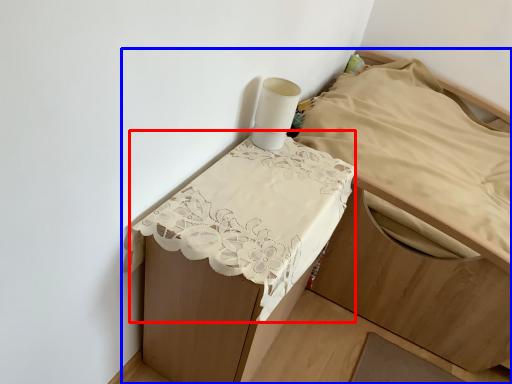
Question: Which object appears farthest to the camera in this image, sheet (highlighted by a red box) or furniture (highlighted by a blue box)?

Choices:
 (A) sheet
 (B) furniture

Answer: (B)